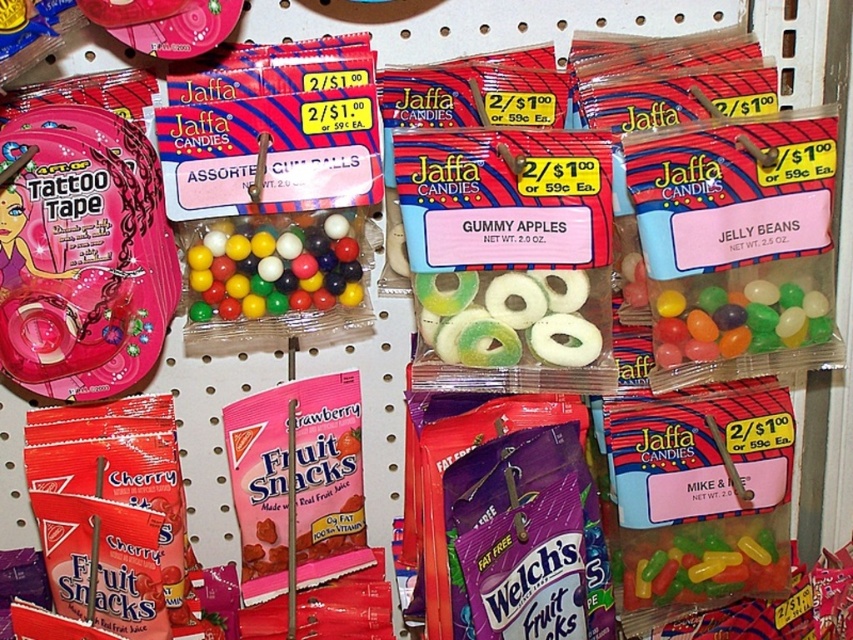
Question: Which point is farther to the camera?

Choices:
 (A) (428, 346)
 (B) (270, 272)
 (C) (653, 557)

Answer: (C)

Question: Can you confirm if green translucent gummy rings at center is smaller than translucent jelly beans at center?

Choices:
 (A) no
 (B) yes

Answer: (A)

Question: Which object is positioned farthest from the glossy plastic gumballs at center?

Choices:
 (A) green translucent gummy rings at center
 (B) translucent jelly beans at right
 (C) translucent jelly beans at center

Answer: (C)

Question: Does green translucent gummy rings at center appear on the right side of translucent jelly beans at center?

Choices:
 (A) yes
 (B) no

Answer: (B)

Question: In this image, where is green translucent gummy rings at center located relative to translucent jelly beans at right?

Choices:
 (A) right
 (B) left

Answer: (B)

Question: Which is nearer to the translucent jelly beans at right?

Choices:
 (A) green translucent gummy rings at center
 (B) glossy plastic gumballs at center

Answer: (A)